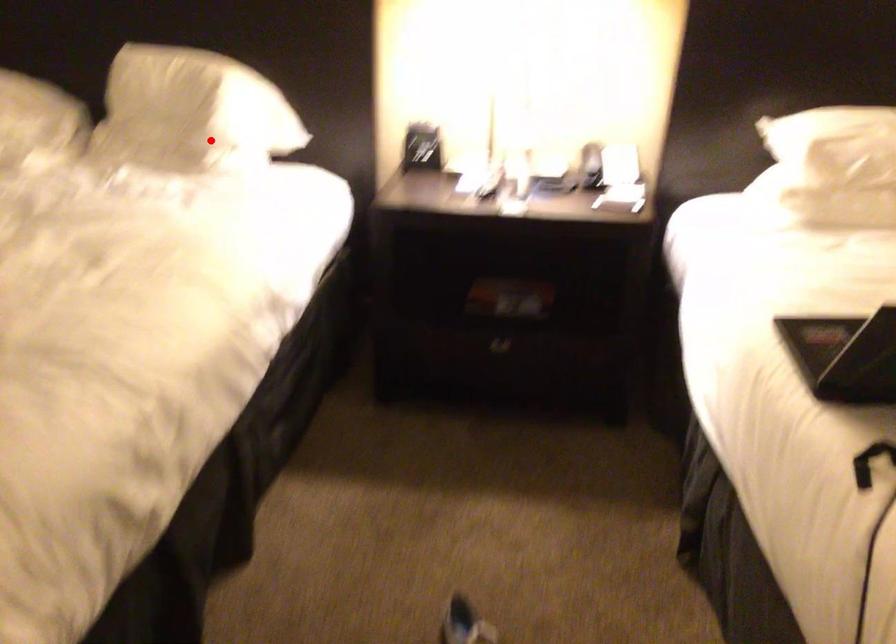
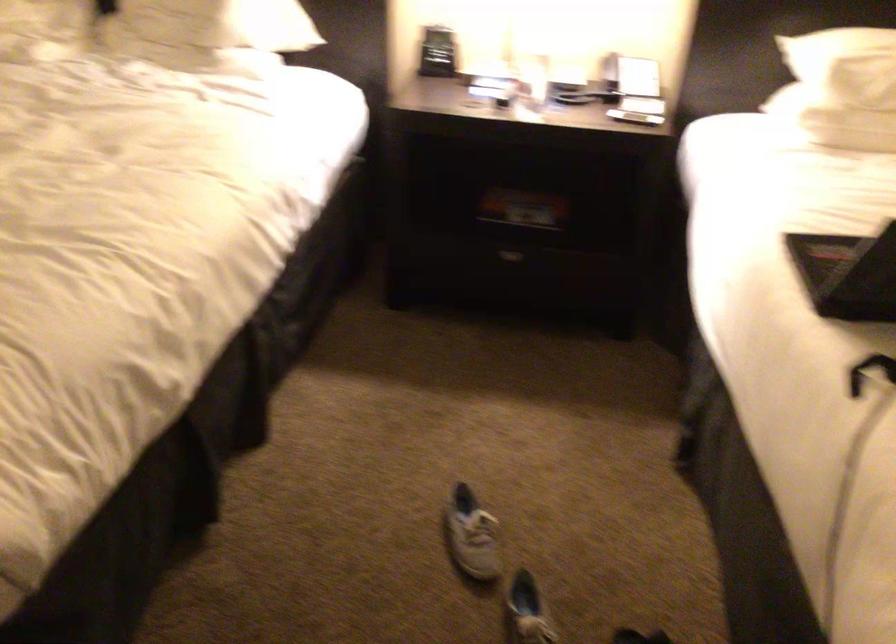
The point at the highlighted location is marked in the first image. Where is the corresponding point in the second image?

(227, 35)